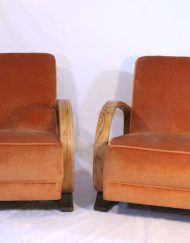
At what (x,y) coordinates should I click in order to perform the action: click on velvet looking fabric on chairs. Please return your answer as a coordinate pair (x, y). The image size is (190, 243). Looking at the image, I should click on (31, 100).